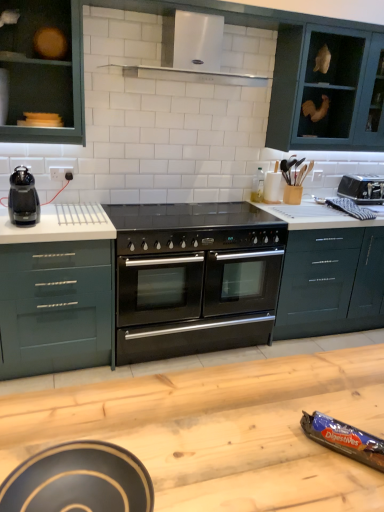
Question: Are glossy dark green drawer at center-right, the second drawer in the left-to-right sequence, and black plastic coffee maker at left located far from each other?

Choices:
 (A) no
 (B) yes

Answer: (B)

Question: Can you see glossy dark green drawer at center-right, the first drawer in the right-to-left sequence, touching black plastic coffee maker at left?

Choices:
 (A) yes
 (B) no

Answer: (B)

Question: Does glossy dark green drawer at center-right, the first drawer in the right-to-left sequence, have a lesser width compared to black plastic coffee maker at left?

Choices:
 (A) yes
 (B) no

Answer: (B)

Question: Could you tell me if glossy dark green drawer at center-right, the first drawer in the right-to-left sequence, is turned towards black plastic coffee maker at left?

Choices:
 (A) no
 (B) yes

Answer: (A)

Question: Can you confirm if glossy dark green drawer at center-right, the first drawer in the right-to-left sequence, is positioned to the left of black plastic coffee maker at left?

Choices:
 (A) no
 (B) yes

Answer: (A)

Question: From their relative heights in the image, would you say blue foil digestives at lower right, the second appliance when ordered from bottom to top, is taller or shorter than white stainless steel exhaust hood at upper center?

Choices:
 (A) short
 (B) tall

Answer: (A)

Question: Would you say blue foil digestives at lower right, the second appliance when ordered from bottom to top, is inside or outside white stainless steel exhaust hood at upper center?

Choices:
 (A) inside
 (B) outside

Answer: (B)

Question: Is point (365, 450) positioned closer to the camera than point (160, 72)?

Choices:
 (A) farther
 (B) closer

Answer: (B)

Question: From the image's perspective, is blue foil digestives at lower right, the 2th appliance from the right, located above or below white stainless steel exhaust hood at upper center?

Choices:
 (A) below
 (B) above

Answer: (A)

Question: Considering their positions, is green matte drawer at left, which ranks as the first drawer in left-to-right order, located in front of or behind matte black bowl at lower left, arranged as the third appliance when viewed from the back?

Choices:
 (A) front
 (B) behind

Answer: (B)

Question: In the image, is green matte drawer at left, which ranks as the first drawer in left-to-right order, on the left side or the right side of matte black bowl at lower left, arranged as the 3th appliance when viewed from the right?

Choices:
 (A) right
 (B) left

Answer: (B)

Question: Is green matte drawer at left, which ranks as the second drawer in right-to-left order, wider or thinner than matte black bowl at lower left, placed as the first appliance when sorted from left to right?

Choices:
 (A) thin
 (B) wide

Answer: (B)

Question: Is green matte drawer at left, which ranks as the second drawer in right-to-left order, bigger or smaller than matte black bowl at lower left, arranged as the 1th appliance when viewed from the front?

Choices:
 (A) small
 (B) big

Answer: (B)

Question: Considering the positions of glossy dark green drawer at center-right, the first drawer in the right-to-left sequence, and green matte drawer at left, which ranks as the second drawer in right-to-left order, in the image, is glossy dark green drawer at center-right, the first drawer in the right-to-left sequence, wider or thinner than green matte drawer at left, which ranks as the second drawer in right-to-left order,?

Choices:
 (A) wide
 (B) thin

Answer: (B)

Question: Relative to green matte drawer at left, which ranks as the second drawer in right-to-left order, is glossy dark green drawer at center-right, the first drawer in the right-to-left sequence, in front or behind?

Choices:
 (A) behind
 (B) front

Answer: (A)